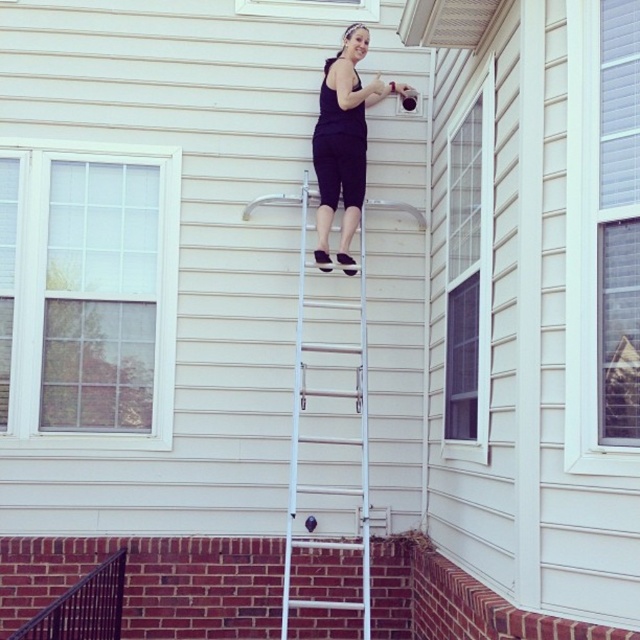
Question: Which point is closer to the camera taking this photo?

Choices:
 (A) (330, 369)
 (B) (353, 88)
 (C) (112, 576)

Answer: (C)

Question: Which point is closer to the camera?

Choices:
 (A) black metal/rail at lower left
 (B) black matte pants at upper center
 (C) white metallic ladder at center

Answer: (A)

Question: Is white metallic ladder at center above black metal/rail at lower left?

Choices:
 (A) no
 (B) yes

Answer: (B)

Question: Among these objects, which one is farthest from the camera?

Choices:
 (A) white metallic ladder at center
 (B) black matte pants at upper center

Answer: (B)

Question: Is black matte pants at upper center further to the viewer compared to black metal/rail at lower left?

Choices:
 (A) yes
 (B) no

Answer: (A)

Question: From the image, what is the correct spatial relationship of black matte pants at upper center in relation to black metal/rail at lower left?

Choices:
 (A) left
 (B) right

Answer: (B)